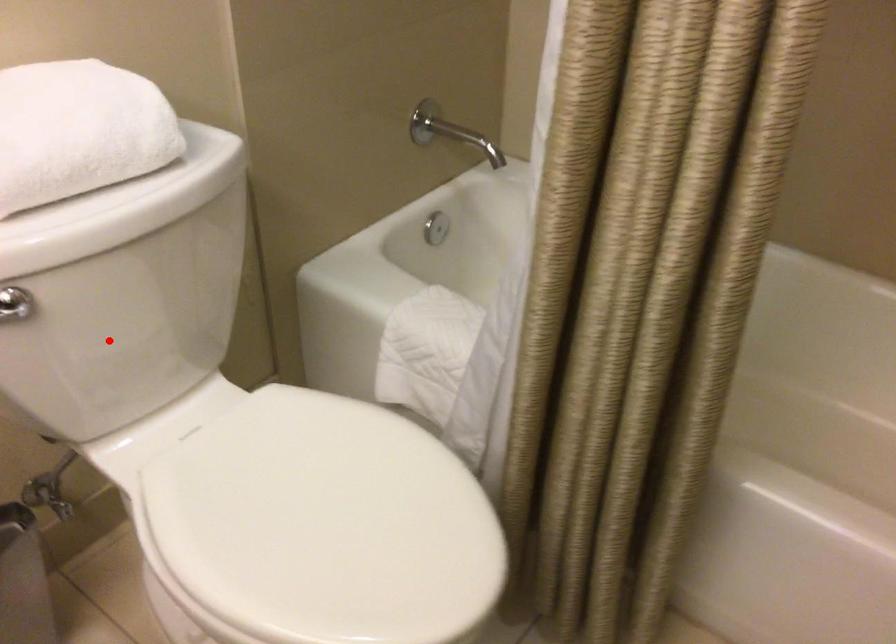
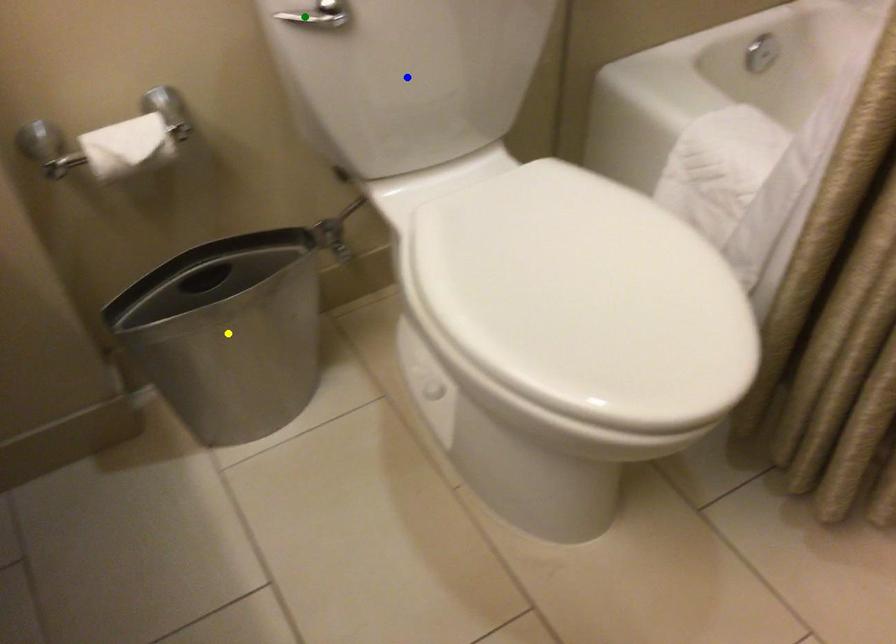
Question: I am providing you with two images of the same scene from different viewpoints. A red point is marked on the first image. You are given multiple points on the second image. Can you choose the point in image 2 that corresponds to the point in image 1?

Choices:
 (A) green point
 (B) yellow point
 (C) blue point

Answer: (C)